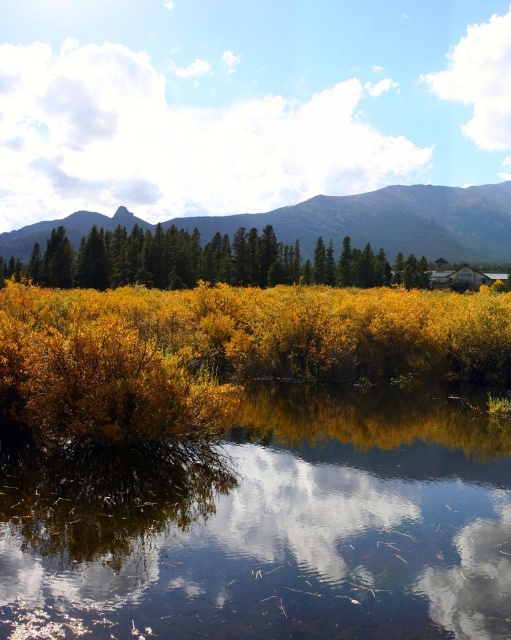
Question: Which object is the farthest from the green matte trees at center?

Choices:
 (A) rocky mountain at upper center
 (B) glossy reflective water at center

Answer: (B)

Question: From the image, what is the correct spatial relationship of glossy reflective water at center in relation to green matte trees at center?

Choices:
 (A) below
 (B) above

Answer: (A)

Question: Is green matte trees at center positioned behind rocky mountain at upper center?

Choices:
 (A) yes
 (B) no

Answer: (B)

Question: Which of the following is the farthest from the observer?

Choices:
 (A) [45, 259]
 (B) [456, 221]
 (C) [258, 538]

Answer: (B)

Question: Estimate the real-world distances between objects in this image. Which object is farther from the rocky mountain at upper center?

Choices:
 (A) glossy reflective water at center
 (B) green matte trees at center

Answer: (A)

Question: Does glossy reflective water at center have a greater width compared to green matte trees at center?

Choices:
 (A) yes
 (B) no

Answer: (B)